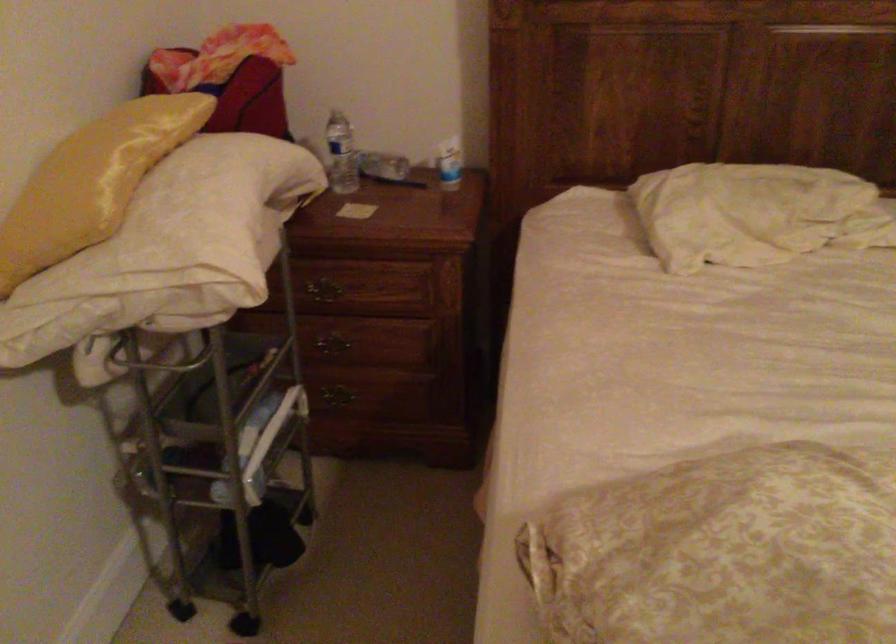
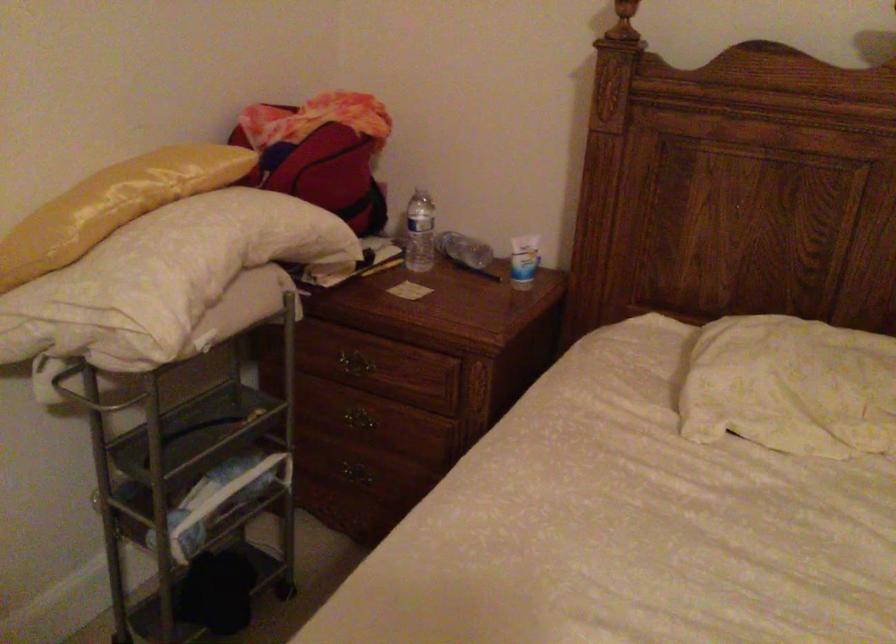
Where in the second image is the point corresponding to point (453, 162) from the first image?

(523, 261)